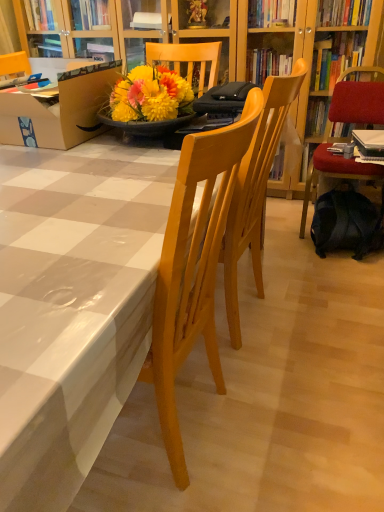
Locate an element on the screen. The height and width of the screenshot is (512, 384). free space in front of brown cardboard box at left is located at coordinates (67, 175).